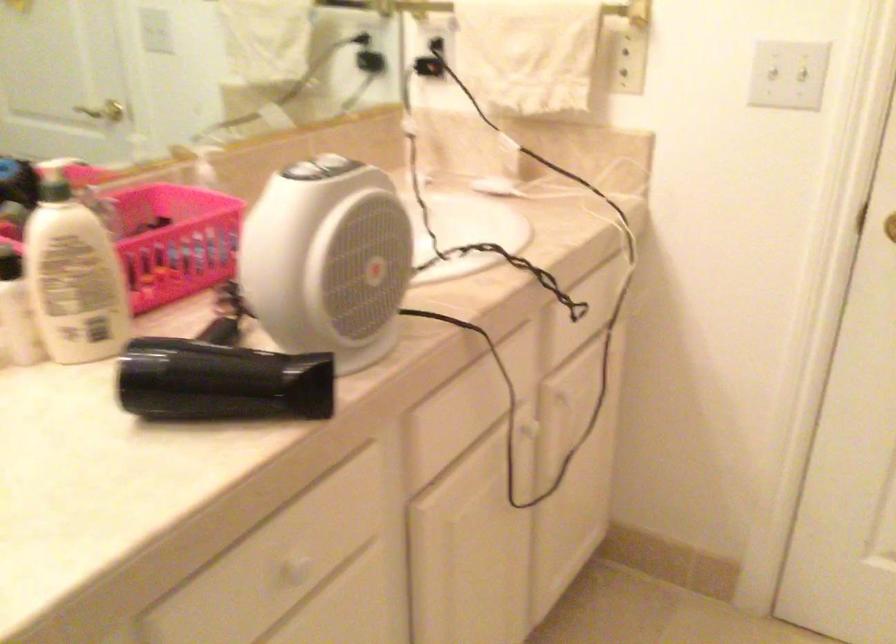
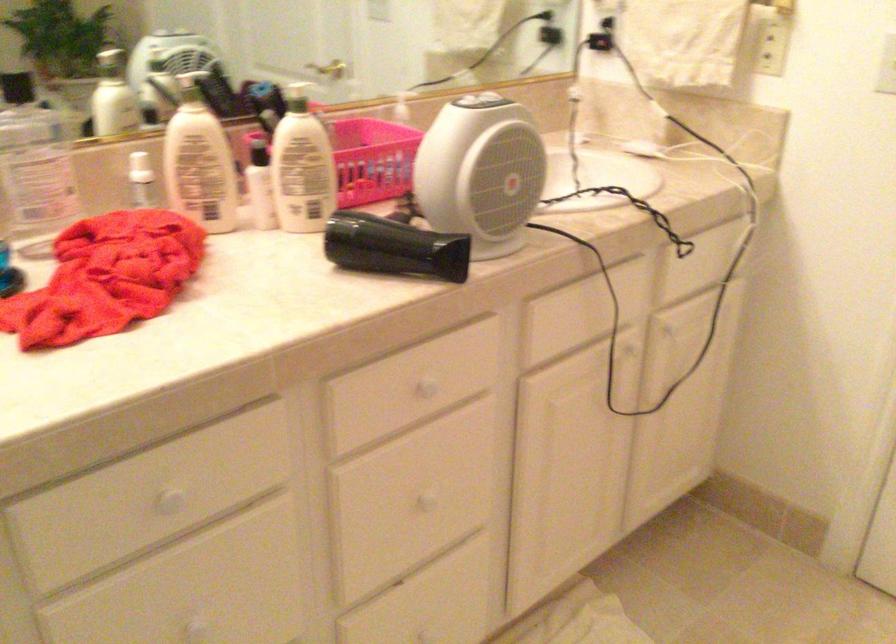
Locate, in the second image, the point that corresponds to point 573,398 in the first image.

(675, 335)